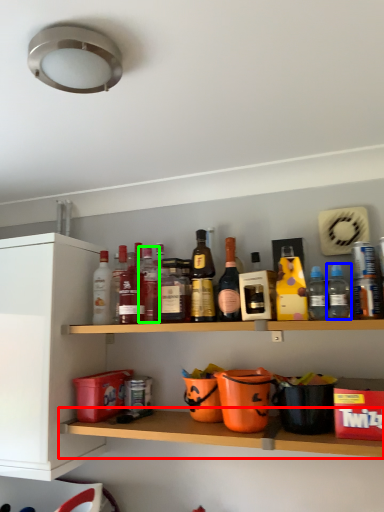
Question: Estimate the real-world distances between objects in this image. Which object is closer to shelf (highlighted by a red box), bottle (highlighted by a blue box) or bottle (highlighted by a green box)?

Choices:
 (A) bottle
 (B) bottle

Answer: (B)